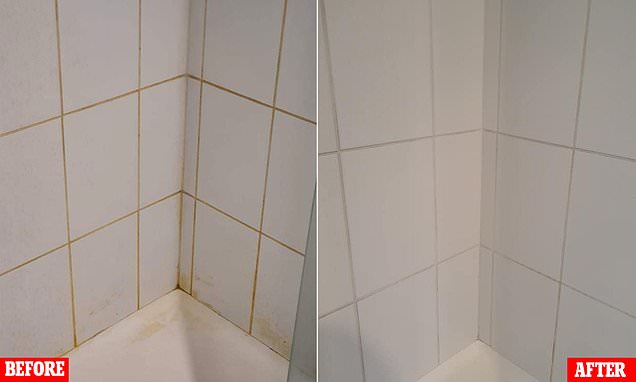
The image size is (636, 382). Identify the location of stain in corner on tile. (182, 283).